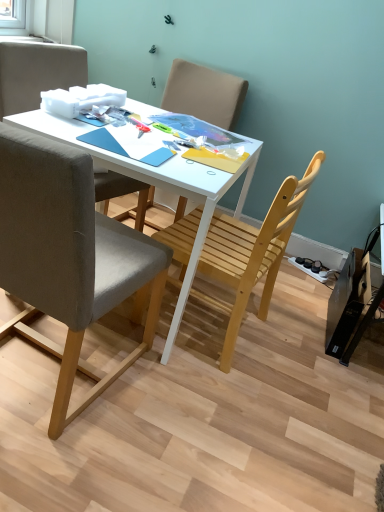
Question: Is light brown wooden chair at center, which is counted as the 1th chair, starting from the back, turned away from gray fabric chair at left, acting as the 4th chair starting from the back?

Choices:
 (A) no
 (B) yes

Answer: (A)

Question: Is light brown wooden chair at center, which is counted as the 1th chair, starting from the back, not near gray fabric chair at left, acting as the 4th chair starting from the back?

Choices:
 (A) no
 (B) yes

Answer: (B)

Question: Could you tell me if light brown wooden chair at center, which is counted as the 1th chair, starting from the back, is facing gray fabric chair at left, acting as the 4th chair starting from the back?

Choices:
 (A) yes
 (B) no

Answer: (A)

Question: From the image's perspective, is light brown wooden chair at center, which is the 4th chair from front to back, over gray fabric chair at left, acting as the 4th chair starting from the back?

Choices:
 (A) yes
 (B) no

Answer: (A)

Question: Can you confirm if light brown wooden chair at center, which is the 4th chair from front to back, is taller than gray fabric chair at left, which is counted as the first chair, starting from the front?

Choices:
 (A) yes
 (B) no

Answer: (B)

Question: Is point (228, 329) positioned closer to the camera than point (9, 109)?

Choices:
 (A) farther
 (B) closer

Answer: (B)

Question: From the image's perspective, is light wood chair at center, which is the third chair in back-to-front order, above or below matte gray chair at upper left, marked as the third chair in a front-to-back arrangement?

Choices:
 (A) below
 (B) above

Answer: (A)

Question: In terms of height, does light wood chair at center, which is the third chair in back-to-front order, look taller or shorter compared to matte gray chair at upper left, the second chair from the back?

Choices:
 (A) tall
 (B) short

Answer: (A)

Question: Is light wood chair at center, which is the third chair in back-to-front order, to the left or to the right of matte gray chair at upper left, marked as the third chair in a front-to-back arrangement, in the image?

Choices:
 (A) right
 (B) left

Answer: (A)

Question: Is point (185, 245) positioned closer to the camera than point (152, 173)?

Choices:
 (A) closer
 (B) farther

Answer: (B)

Question: Is light wood chair at center, which is the third chair in back-to-front order, in front of or behind white matte desk at center in the image?

Choices:
 (A) behind
 (B) front

Answer: (B)

Question: Considering the positions of light wood chair at center, which is the third chair in back-to-front order, and white matte desk at center in the image, is light wood chair at center, which is the third chair in back-to-front order, bigger or smaller than white matte desk at center?

Choices:
 (A) small
 (B) big

Answer: (A)

Question: In the image, is light wood chair at center, placed as the second chair when sorted from front to back, on the left side or the right side of white matte desk at center?

Choices:
 (A) left
 (B) right

Answer: (B)

Question: Is point (173, 97) closer or farther from the camera than point (231, 239)?

Choices:
 (A) farther
 (B) closer

Answer: (A)

Question: Visually, is light brown wooden chair at center, which is the 4th chair from front to back, positioned to the left or to the right of light wood chair at center, placed as the second chair when sorted from front to back?

Choices:
 (A) left
 (B) right

Answer: (A)